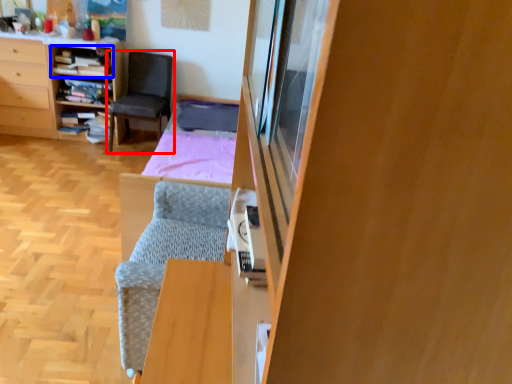
Question: Which of the following is the farthest to the observer, chair (highlighted by a red box) or shelf (highlighted by a blue box)?

Choices:
 (A) chair
 (B) shelf

Answer: (B)